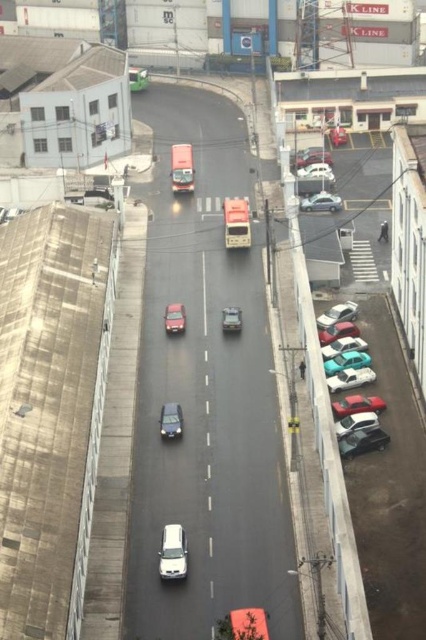
You are a delivery person who needs to load a large package onto a vehicle. You see the matte red bus at center and the metallic silver car at center. Which vehicle can accommodate the large package based on their sizes?

The matte red bus at center has a larger size compared to the metallic silver car at center, so the large package can fit in the matte red bus at center.

You are a delivery driver navigating an urban street scene. You need to deliver a package to the teal glossy car at right. The GPS shows a point at coordinates (x=359, y=422). Can you confirm if this point leads directly to the teal glossy car at right?

Yes, the point at coordinates (x=359, y=422) corresponds to the teal glossy car at right, so following this point will lead you directly to the teal glossy car at right.